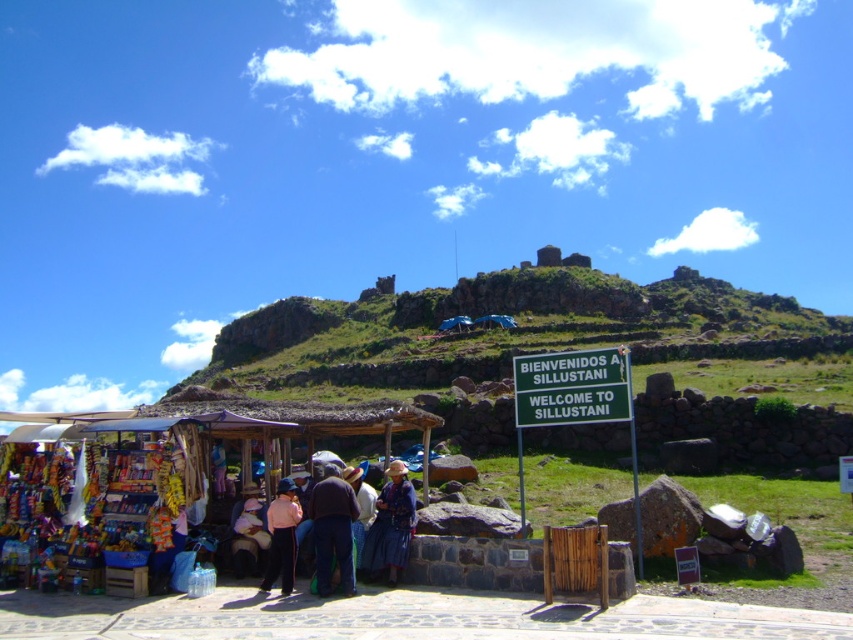
Measure the distance from brown woven hat at center to matte pink shirt at center.

brown woven hat at center and matte pink shirt at center are 7.66 feet apart from each other.

Can you confirm if brown woven hat at center is wider than matte pink shirt at center?

Yes.

Is point (312, 488) positioned after point (283, 496)?

Yes, it is.

Find the location of a particular element. This screenshot has height=640, width=853. brown woven hat at center is located at coordinates (332, 531).

How far apart are matte pink shirt at center and blue woven hat at center?

matte pink shirt at center is 11.51 feet away from blue woven hat at center.

Which is more to the right, matte pink shirt at center or blue woven hat at center?

Positioned to the right is blue woven hat at center.

Does point (268, 557) lie in front of point (367, 515)?

That is True.

Find the location of a particular element. matte pink shirt at center is located at coordinates (281, 538).

Can you confirm if blue fabric dress at center is positioned above blue woven hat at center?

Incorrect, blue fabric dress at center is not positioned above blue woven hat at center.

Which of these two, blue fabric dress at center or blue woven hat at center, stands taller?

With more height is blue fabric dress at center.

You are a GUI agent. You are given a task and a screenshot of the screen. Output one action in this format:
    pyautogui.click(x=<x>, y=<y>)
    Task: Click on the blue fabric dress at center
    The image size is (853, 640).
    Given the screenshot: What is the action you would take?
    pyautogui.click(x=316, y=532)

The height and width of the screenshot is (640, 853). I want to click on blue fabric dress at center, so click(316, 532).